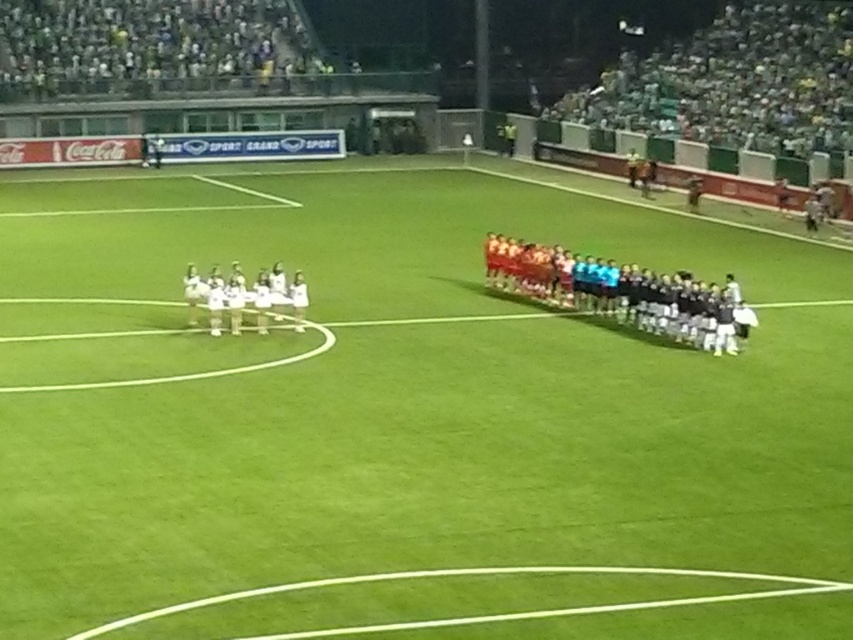
Question: Can you confirm if green grass field at center is bigger than white smooth line at lower center?

Choices:
 (A) no
 (B) yes

Answer: (B)

Question: Does green grass field at center come behind white smooth line at lower center?

Choices:
 (A) no
 (B) yes

Answer: (A)

Question: Which of these objects is positioned closest to the white smooth line at lower center?

Choices:
 (A) green grass field at center
 (B) orange jersey at center

Answer: (B)

Question: Is green grass field at center behind orange jersey at center?

Choices:
 (A) no
 (B) yes

Answer: (A)

Question: Considering the real-world distances, which object is farthest from the white smooth line at lower center?

Choices:
 (A) green grass field at center
 (B) orange jersey at center

Answer: (A)

Question: Which object appears closest to the camera in this image?

Choices:
 (A) green grass field at center
 (B) orange jersey at center
 (C) white smooth line at lower center

Answer: (A)